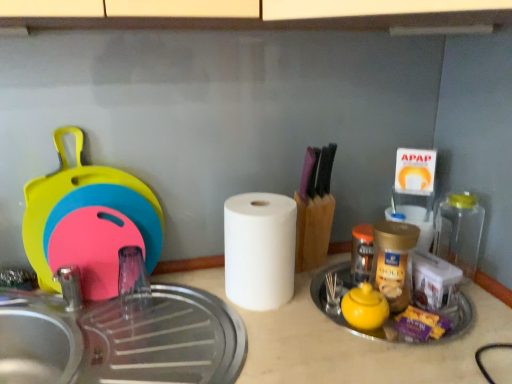
At what (x,y) coordinates should I click in order to perform the action: click on free spot to the left of transparent plastic faucet at left. Please return your answer as a coordinate pair (x, y). This screenshot has height=384, width=512. Looking at the image, I should click on (93, 311).